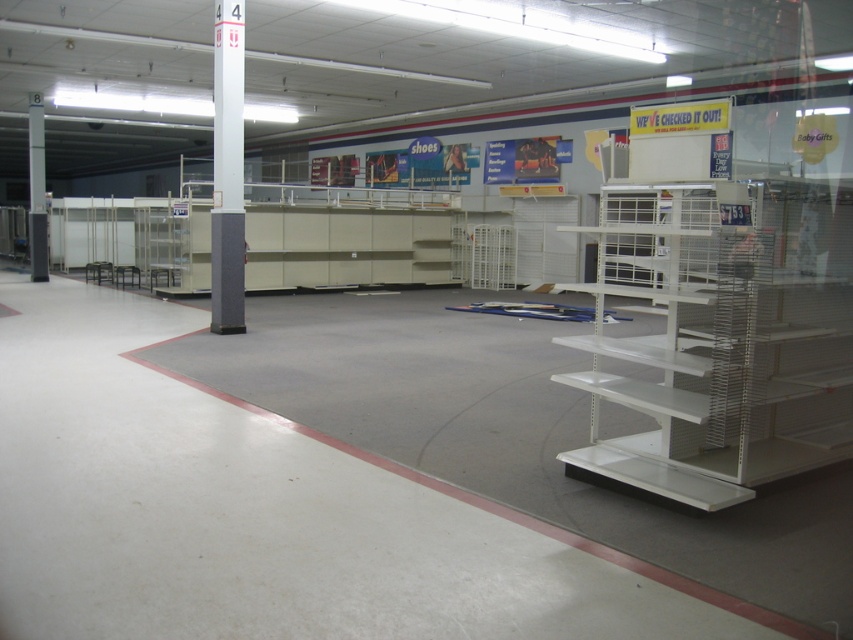
Is white metal shelf at right above gray concrete pillar at left?

No, white metal shelf at right is not above gray concrete pillar at left.

Which is behind, point (785, 337) or point (28, 200)?

Point (28, 200)

Where is `white metal shelf at right`? white metal shelf at right is located at coordinates (724, 339).

Does white textured pole at center have a greater width compared to gray concrete pillar at left?

In fact, white textured pole at center might be narrower than gray concrete pillar at left.

Does white textured pole at center appear under gray concrete pillar at left?

Correct, white textured pole at center is located below gray concrete pillar at left.

Does point (238, 282) come in front of point (38, 225)?

That is True.

Image resolution: width=853 pixels, height=640 pixels. What are the coordinates of `white textured pole at center` in the screenshot? It's located at (227, 170).

Between white metal shelf at right and white textured pole at center, which one appears on the right side from the viewer's perspective?

white metal shelf at right

The height and width of the screenshot is (640, 853). Describe the element at coordinates (724, 339) in the screenshot. I see `white metal shelf at right` at that location.

What do you see at coordinates (724, 339) in the screenshot? I see `white metal shelf at right` at bounding box center [724, 339].

Locate an element on the screen. This screenshot has height=640, width=853. white metal shelf at right is located at coordinates (724, 339).